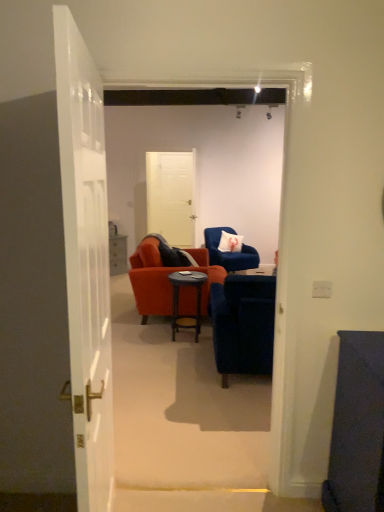
Locate an element on the screen. blank area beneath dark wood side table at center (from a real-world perspective) is located at coordinates (183, 338).